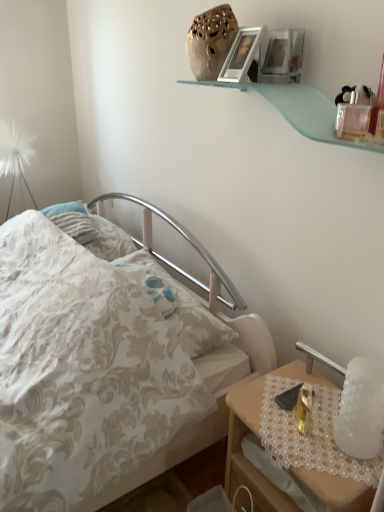
You are a GUI agent. You are given a task and a screenshot of the screen. Output one action in this format:
    pyautogui.click(x=<x>, y=<y>)
    Task: Click on the white frosted glass bedside lamp at right
    
    Given the screenshot: What is the action you would take?
    pyautogui.click(x=356, y=403)

The width and height of the screenshot is (384, 512). Identify the location of wooden nightstand at lower right. (242, 452).

At what (x,y) coordinates should I click in order to perform the action: click on white frosted glass bedside lamp at right. Please return your answer as a coordinate pair (x, y). This screenshot has width=384, height=512. Looking at the image, I should click on (356, 403).

Does wooden nightstand at lower right turn towards white floral fabric bed at center?

No, wooden nightstand at lower right is not aimed at white floral fabric bed at center.

Considering the sizes of wooden nightstand at lower right and white floral fabric bed at center in the image, is wooden nightstand at lower right taller or shorter than white floral fabric bed at center?

In the image, wooden nightstand at lower right appears to be shorter than white floral fabric bed at center.

Relative to white floral fabric bed at center, is wooden nightstand at lower right in front or behind?

In the image, wooden nightstand at lower right appears behind white floral fabric bed at center.

Is clear plastic perfume bottle at upper right thinner than white frosted glass bedside lamp at right?

Correct, the width of clear plastic perfume bottle at upper right is less than that of white frosted glass bedside lamp at right.

Can you confirm if clear plastic perfume bottle at upper right is positioned to the right of white frosted glass bedside lamp at right?

No.

From a real-world perspective, is clear plastic perfume bottle at upper right below white frosted glass bedside lamp at right?

No, from a real-world perspective, clear plastic perfume bottle at upper right is not beneath white frosted glass bedside lamp at right.

Is clear plastic perfume bottle at upper right closer to the viewer compared to white frosted glass bedside lamp at right?

No, the depth of clear plastic perfume bottle at upper right is greater than that of white frosted glass bedside lamp at right.

Is white floral fabric bed at center facing away from clear plastic perfume bottle at upper right?

No.

Between white floral fabric bed at center and clear plastic perfume bottle at upper right, which one appears on the right side from the viewer's perspective?

clear plastic perfume bottle at upper right is more to the right.

Relative to clear plastic perfume bottle at upper right, is white floral fabric bed at center in front or behind?

Clearly, white floral fabric bed at center is in front of clear plastic perfume bottle at upper right.

Is white floral fabric bed at center outside of clear plastic perfume bottle at upper right?

Yes, white floral fabric bed at center is outside of clear plastic perfume bottle at upper right.

Looking at this image, does wooden nightstand at lower right come behind matte silver picture frame at upper center?

No, it is not.

Is matte silver picture frame at upper center located within wooden nightstand at lower right?

Definitely not — matte silver picture frame at upper center is not inside wooden nightstand at lower right.

Looking at their sizes, would you say wooden nightstand at lower right is wider or thinner than matte silver picture frame at upper center?

wooden nightstand at lower right is wider than matte silver picture frame at upper center.

Between white frosted glass bedside lamp at right and clear plastic perfume bottle at upper right, which one is positioned behind?

clear plastic perfume bottle at upper right is further from the camera.

Considering the relative sizes of white frosted glass bedside lamp at right and clear plastic perfume bottle at upper right in the image provided, is white frosted glass bedside lamp at right shorter than clear plastic perfume bottle at upper right?

In fact, white frosted glass bedside lamp at right may be taller than clear plastic perfume bottle at upper right.

From a real-world perspective, is white frosted glass bedside lamp at right located higher than clear plastic perfume bottle at upper right?

No.

Considering the relative positions of wooden nightstand at lower right and white frosted glass bedside lamp at right in the image provided, is wooden nightstand at lower right behind white frosted glass bedside lamp at right?

No, wooden nightstand at lower right is closer to the viewer.

How far apart are wooden nightstand at lower right and white frosted glass bedside lamp at right?

wooden nightstand at lower right is 9.62 inches away from white frosted glass bedside lamp at right.

Is wooden nightstand at lower right thinner than white frosted glass bedside lamp at right?

Incorrect, the width of wooden nightstand at lower right is not less than that of white frosted glass bedside lamp at right.

Is wooden nightstand at lower right spatially inside white frosted glass bedside lamp at right, or outside of it?

wooden nightstand at lower right cannot be found inside white frosted glass bedside lamp at right.

Does point (131, 362) come closer to viewer compared to point (236, 59)?

Yes, it is in front of point (236, 59).

From their relative heights in the image, would you say white floral fabric bed at center is taller or shorter than matte silver picture frame at upper center?

In the image, white floral fabric bed at center appears to be taller than matte silver picture frame at upper center.

Is white floral fabric bed at center to the left or to the right of matte silver picture frame at upper center in the image?

white floral fabric bed at center is to the left of matte silver picture frame at upper center.

Can you confirm if white floral fabric bed at center is thinner than matte silver picture frame at upper center?

Incorrect, the width of white floral fabric bed at center is not less than that of matte silver picture frame at upper center.

Image resolution: width=384 pixels, height=512 pixels. Identify the location of nightstand located behind the white floral fabric bed at center. (242, 452).

Identify the location of bedside lamp below the clear plastic perfume bottle at upper right (from the image's perspective). This screenshot has width=384, height=512. (356, 403).

Estimate the real-world distances between objects in this image. Which object is closer to white floral fabric bed at center, wooden nightstand at lower right or clear plastic perfume bottle at upper right?

wooden nightstand at lower right lies closer to white floral fabric bed at center than the other object.

Looking at the image, which one is located further to clear plastic perfume bottle at upper right, white floral fabric bed at center or matte silver picture frame at upper center?

Among the two, white floral fabric bed at center is located further to clear plastic perfume bottle at upper right.

From the picture: Estimate the real-world distances between objects in this image. Which object is closer to white frosted glass bedside lamp at right, clear plastic perfume bottle at upper right or wooden nightstand at lower right?

wooden nightstand at lower right lies closer to white frosted glass bedside lamp at right than the other object.

When comparing their distances from white frosted glass bedside lamp at right, does white floral fabric bed at center or wooden nightstand at lower right seem closer?

wooden nightstand at lower right is positioned closer to the anchor white frosted glass bedside lamp at right.

Based on their spatial positions, is white floral fabric bed at center or white frosted glass bedside lamp at right closer to wooden nightstand at lower right?

white frosted glass bedside lamp at right lies closer to wooden nightstand at lower right than the other object.

When comparing their distances from white floral fabric bed at center, does matte silver picture frame at upper center or white frosted glass bedside lamp at right seem further?

matte silver picture frame at upper center lies further to white floral fabric bed at center than the other object.

When comparing their distances from white frosted glass bedside lamp at right, does white floral fabric bed at center or clear plastic perfume bottle at upper right seem further?

Based on the image, white floral fabric bed at center appears to be further to white frosted glass bedside lamp at right.

Considering their positions, is wooden nightstand at lower right positioned further to white floral fabric bed at center than matte silver picture frame at upper center?

matte silver picture frame at upper center is further to white floral fabric bed at center.

The width and height of the screenshot is (384, 512). In order to click on bed between matte silver picture frame at upper center and white frosted glass bedside lamp at right from top to bottom in this screenshot , I will do `click(103, 371)`.

This screenshot has height=512, width=384. What are the coordinates of `nightstand between white floral fabric bed at center and white frosted glass bedside lamp at right` in the screenshot? It's located at coord(242,452).

Identify the location of toy between white floral fabric bed at center and white frosted glass bedside lamp at right. This screenshot has height=512, width=384. (353, 111).

Where is `toy between matte silver picture frame at upper center and wooden nightstand at lower right in the up-down direction`? toy between matte silver picture frame at upper center and wooden nightstand at lower right in the up-down direction is located at coordinates (353, 111).